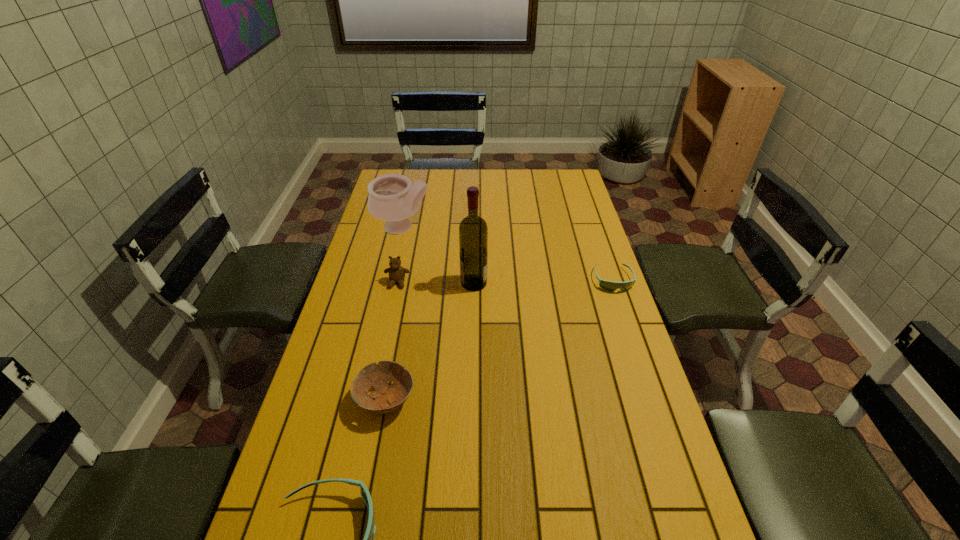
Image resolution: width=960 pixels, height=540 pixels. Identify the location of vacant position for inserting another goggles evenly. (506, 376).